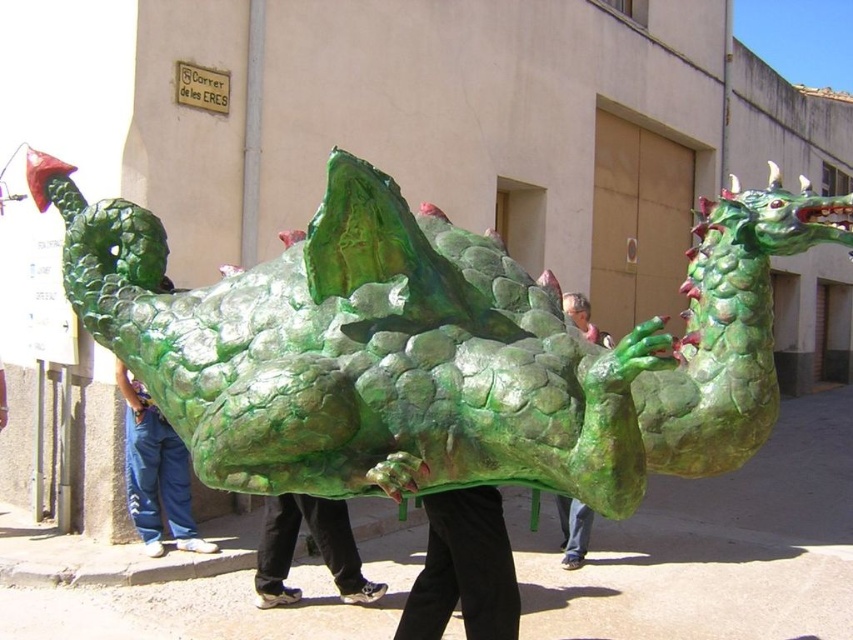
You are a photographer trying to capture a clear shot of the green matte dragon at center. However, the blue jeans at lower left are blocking your view. Based on their positions, can you adjust your angle to see the dragon without the jeans obstructing the shot?

The blue jeans at lower left is above the green matte dragon at center, so adjusting your angle downward might allow you to see the dragon without the jeans blocking the view.

From the picture: You are a photographer trying to capture a photo of the green matte dragon at center and the green matte pants at center. Since both are green and matte, you want to ensure they are positioned correctly in the frame. Which object should you adjust to the right to make sure they are aligned properly?

The green matte pants at center should be moved to the right since it is currently to the left of the green matte dragon at center, so shifting it right would align them properly.

You are a photographer trying to capture a photo of the green scaly dragon at center and the blue jeans at lower left. Which object should you focus on first if you want to ensure both are in the frame without moving the camera?

The green scaly dragon at center is wider than the blue jeans at lower left, so you should focus on the green scaly dragon at center first to ensure it fits within the frame.